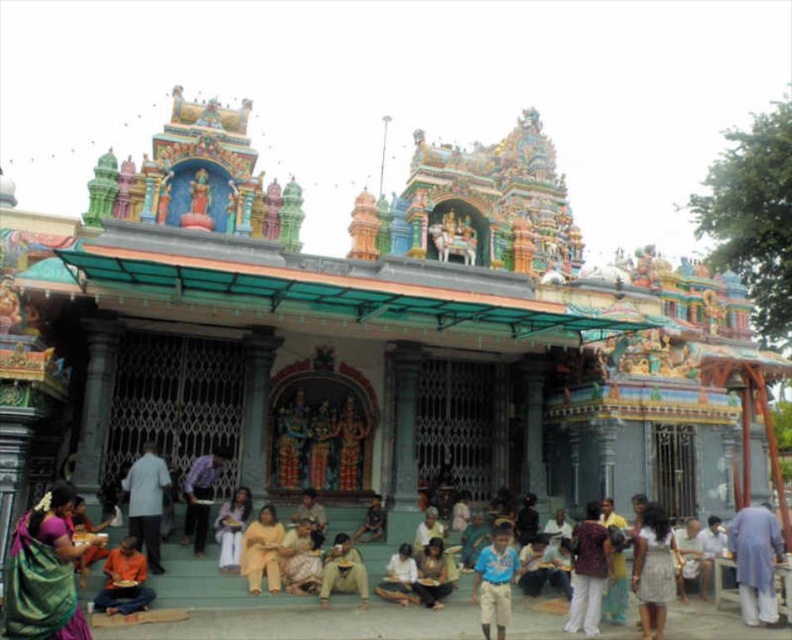
Who is taller, plaid fabric shirt at center or light brown fabric skirt at center?

Standing taller between the two is plaid fabric shirt at center.

Can you confirm if plaid fabric shirt at center is positioned to the right of light brown fabric skirt at center?

Incorrect, plaid fabric shirt at center is not on the right side of light brown fabric skirt at center.

This screenshot has width=792, height=640. Identify the location of plaid fabric shirt at center. (200, 493).

Identify the location of plaid fabric shirt at center. (200, 493).

Does printed cotton shirt at center have a larger size compared to light blue fabric shirt at lower left?

Actually, printed cotton shirt at center might be smaller than light blue fabric shirt at lower left.

Does printed cotton shirt at center have a greater width compared to light blue fabric shirt at lower left?

No, printed cotton shirt at center is not wider than light blue fabric shirt at lower left.

Is point (589, 600) closer to camera compared to point (153, 531)?

Yes, point (589, 600) is closer to viewer.

This screenshot has width=792, height=640. Identify the location of printed cotton shirt at center. (588, 572).

Who is more forward, [471,484] or [421,545]?

Point [421,545]

Looking at this image, can you confirm if multicolored painted temple at center is positioned below light brown fabric at center?

Actually, multicolored painted temple at center is above light brown fabric at center.

What are the coordinates of `multicolored painted temple at center` in the screenshot? It's located at (370, 337).

Locate an element on the screen. multicolored painted temple at center is located at coordinates (370, 337).